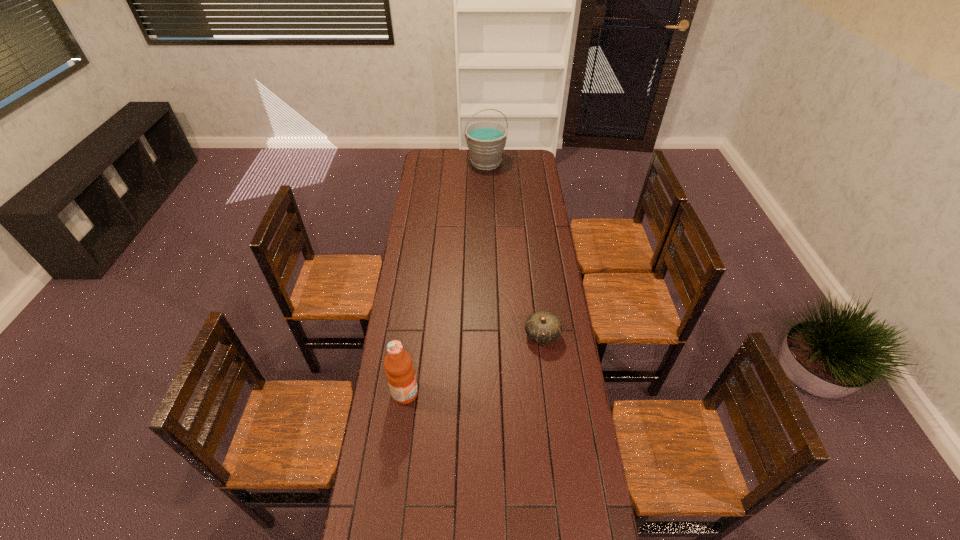
I want to click on free space between the farthest object and the fruit juice, so click(x=445, y=278).

Select which object is the closest to the bucket. Please provide its 2D coordinates. Your answer should be formatted as a tuple, i.e. [(x, y)], where the tuple contains the x and y coordinates of a point satisfying the conditions above.

[(541, 327)]

Identify which object is the closest to the shortest object. Please provide its 2D coordinates. Your answer should be formatted as a tuple, i.e. [(x, y)], where the tuple contains the x and y coordinates of a point satisfying the conditions above.

[(400, 373)]

The width and height of the screenshot is (960, 540). I want to click on vacant area that satisfies the following two spatial constraints: 1. on the front side of the second object from right to left; 2. on the front label of the second shortest object, so click(491, 393).